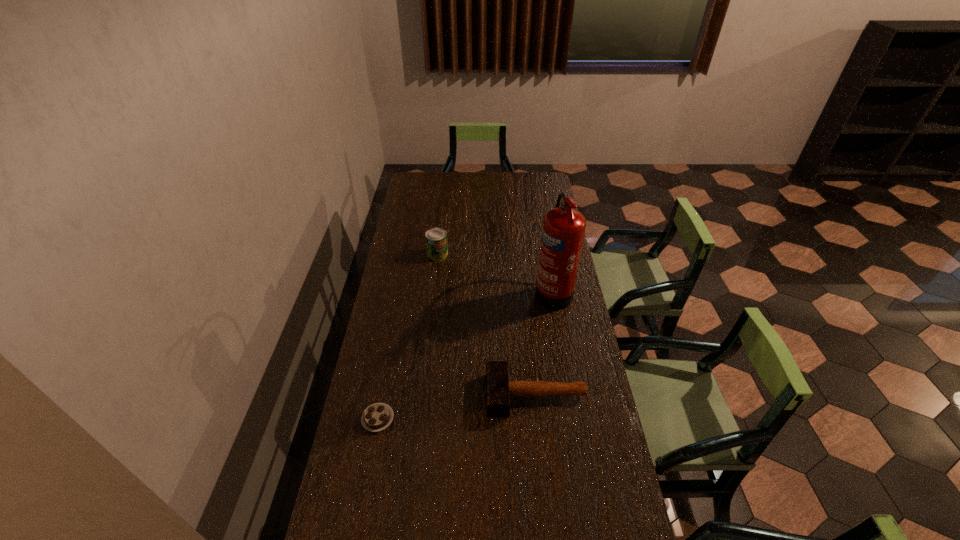
Locate an element on the screen. Image resolution: width=960 pixels, height=540 pixels. vacant space at the right edge is located at coordinates (575, 305).

Where is `vacant space at the far left corner`? This screenshot has height=540, width=960. vacant space at the far left corner is located at coordinates (406, 193).

The height and width of the screenshot is (540, 960). Identify the location of vacant space at the far right corner. (533, 184).

Where is `empty space that is in between the tallest object and the chocolate cake`? empty space that is in between the tallest object and the chocolate cake is located at coordinates (466, 355).

Image resolution: width=960 pixels, height=540 pixels. What are the coordinates of `free space between the leftmost object and the third tallest object` in the screenshot? It's located at (457, 407).

I want to click on vacant area between the third tallest object and the third object from right to left, so click(x=487, y=325).

This screenshot has height=540, width=960. In order to click on vacant area that lies between the third nearest object and the third tallest object in this screenshot , I will do `click(544, 343)`.

Locate an element on the screen. vacant space that is in between the third nearest object and the mallet is located at coordinates (544, 343).

Where is `free space between the leftmost object and the third nearest object`? The image size is (960, 540). free space between the leftmost object and the third nearest object is located at coordinates (466, 355).

Where is `unoccupied area between the fire extinguisher and the third tallest object`? This screenshot has height=540, width=960. unoccupied area between the fire extinguisher and the third tallest object is located at coordinates (544, 343).